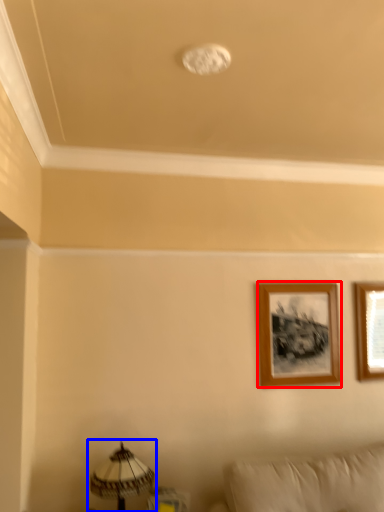
Question: Which object appears farthest to the camera in this image, picture frame (highlighted by a red box) or table lamp (highlighted by a blue box)?

Choices:
 (A) picture frame
 (B) table lamp

Answer: (A)